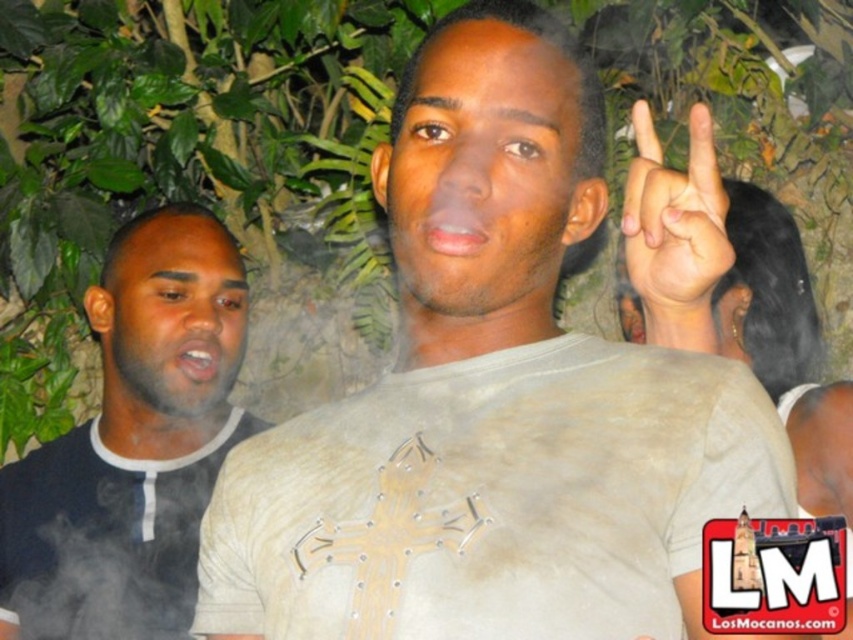
Is black matte shirt at left to the right of white matte hand at upper center from the viewer's perspective?

No, black matte shirt at left is not to the right of white matte hand at upper center.

From the picture: Is black matte shirt at left wider than white matte hand at upper center?

Yes.

Between point (171, 289) and point (657, 252), which one is positioned behind?

The point (171, 289) is behind.

You are a GUI agent. You are given a task and a screenshot of the screen. Output one action in this format:
    pyautogui.click(x=<x>, y=<y>)
    Task: Click on the black matte shirt at left
    The image size is (853, 640).
    Given the screenshot: What is the action you would take?
    pyautogui.click(x=132, y=444)

Which is above, white matte shirt at center or white matte hand at upper center?

white matte hand at upper center is higher up.

Does white matte shirt at center have a lesser width compared to white matte hand at upper center?

No.

Find the location of a particular element. white matte shirt at center is located at coordinates (491, 400).

The height and width of the screenshot is (640, 853). Identify the location of white matte shirt at center. (491, 400).

How far apart are white matte shirt at center and black matte shirt at left?

The distance of white matte shirt at center from black matte shirt at left is 34.10 inches.

You are a GUI agent. You are given a task and a screenshot of the screen. Output one action in this format:
    pyautogui.click(x=<x>, y=<y>)
    Task: Click on the white matte shirt at center
    
    Given the screenshot: What is the action you would take?
    pyautogui.click(x=491, y=400)